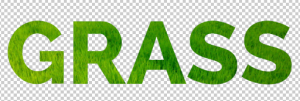
This screenshot has height=101, width=300. Identify the location of art. (212, 56).